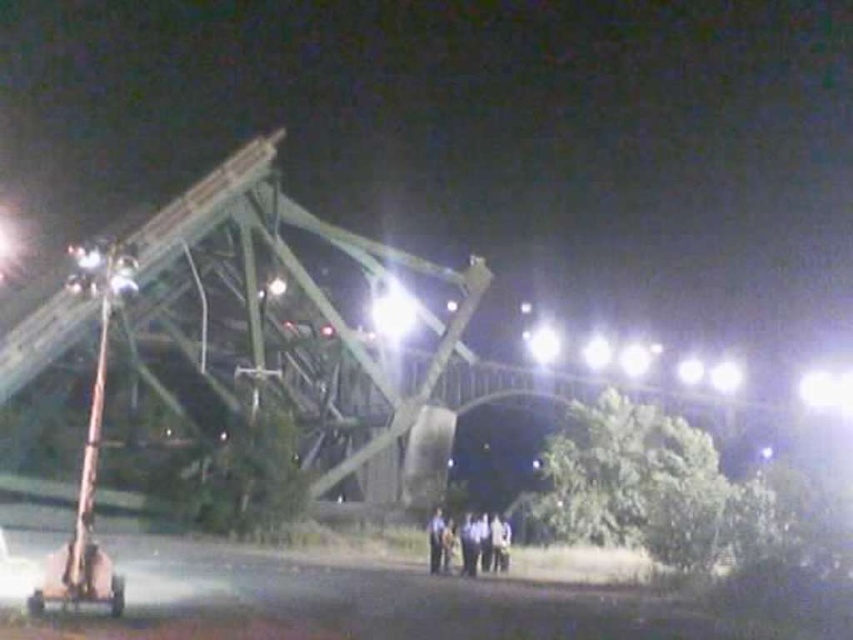
You are a safety officer assessing the scene of a collapsed structure. You notice a dark blue uniform at lower center and a metallic silver car at lower left. Which object is positioned lower in the image?

The dark blue uniform at lower center is positioned below the metallic silver car at lower left, so it is lower in the image.

You are a safety officer assessing the scene. You notice the dark blue uniform at lower center and the metallic silver car at lower left. Which object is taller in this scene?

The dark blue uniform at lower center is taller than the metallic silver car at lower left according to the description.